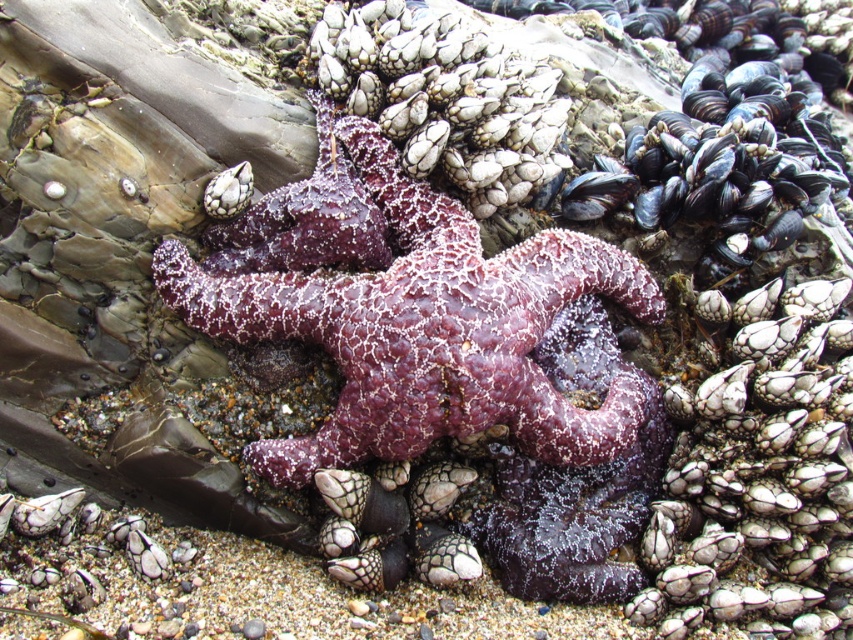
You are a marine biologist examining two starfish in the image. You notice there are a purple matte starfish at center and a purple rough starfish at center. Which one has a bigger size?

The purple matte starfish at center is larger in size than the purple rough starfish at center.

In the image, there are two starfish described as purple matte starfish at center and purple rough starfish at center. Which one is located to the right of the other?

The purple matte starfish at center is to the right of the purple rough starfish at center.